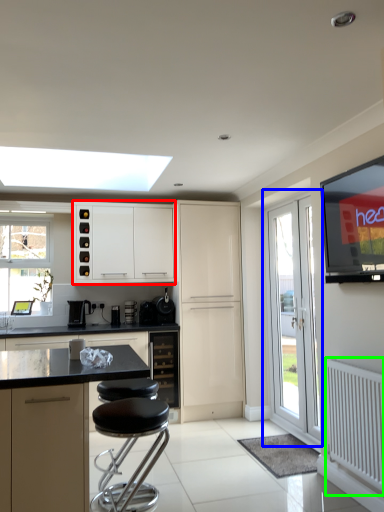
Question: Considering the real-world distances, which object is farthest from cabinetry (highlighted by a red box)? door (highlighted by a blue box) or radiator (highlighted by a green box)?

Choices:
 (A) door
 (B) radiator

Answer: (B)